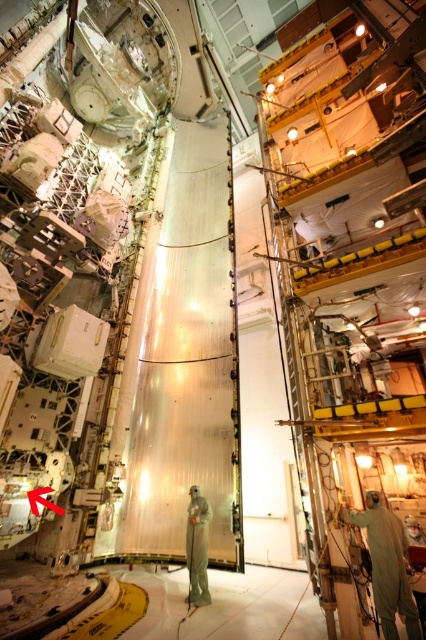
You are an engineer working in this facility and need to access both the point at coordinates point (x=403, y=620) and point (x=195, y=554). If you start from the entrance located near the left side of the facility, which point should you visit first to reach them in the most efficient path?

You should visit point (x=403, y=620) first because it is in front of point (x=195, y=554), so accessing it first would allow you to reach both points more efficiently without backtracking.

You are an inspector in the facility and need to determine if the light green hazmat suit at right can be placed next to the light gray fabric suit at center without overlapping. Based on their widths, what is your conclusion?

The light green hazmat suit at right is wider than the light gray fabric suit at center. Therefore, placing them side by side may require more space to avoid overlapping.

You are an inspector in the facility and need to determine which protective suit is more suitable for a task requiring height adjustment. The light green hazmat suit at right and the light gray fabric suit at center are available. Based on their sizes, which one might allow for greater flexibility in vertical movement?

The light green hazmat suit at right is taller than the light gray fabric suit at center, so it might allow for greater flexibility in vertical movement due to its increased height.